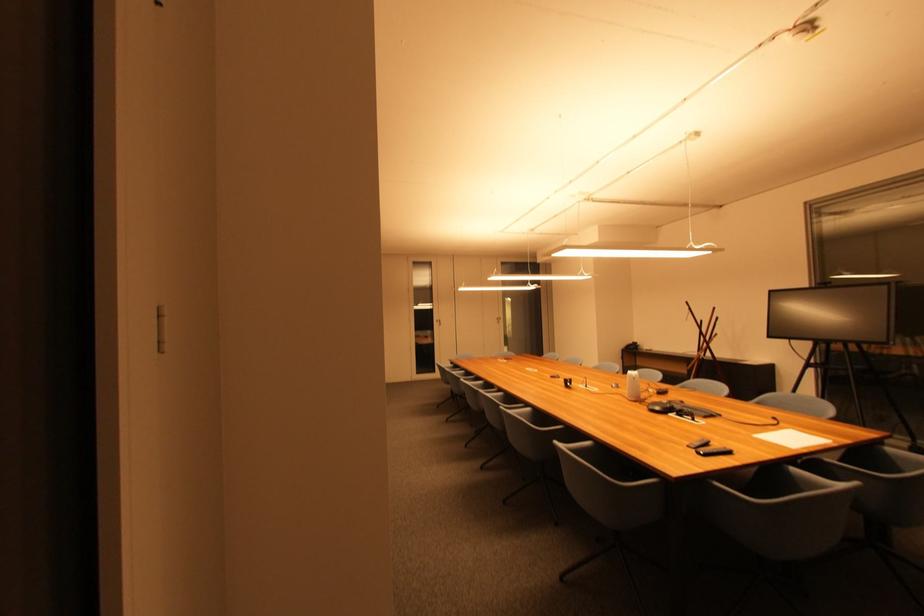
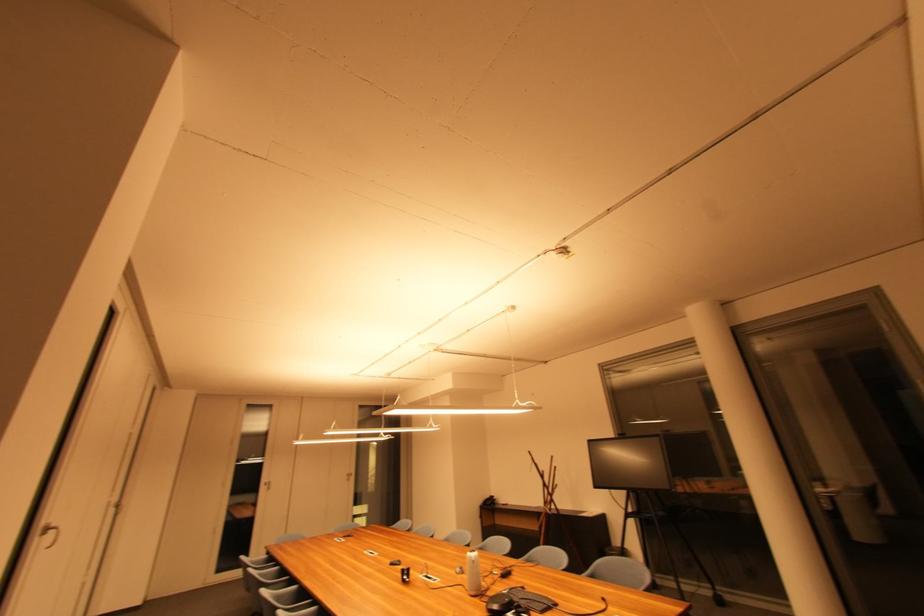
Find the pixel in the second image that matches (682,408) in the first image.

(521, 602)